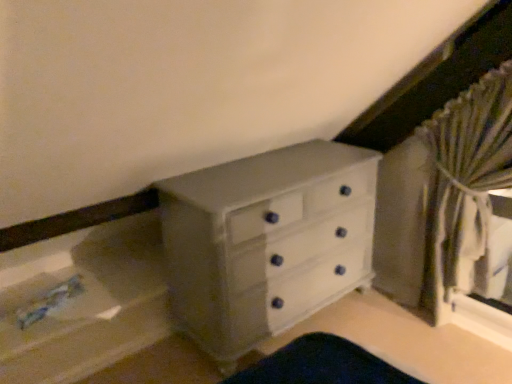
Question: From the image's perspective, is white painted wood chest of drawers at center over striped fabric curtain at right?

Choices:
 (A) no
 (B) yes

Answer: (A)

Question: Is white painted wood chest of drawers at center far from striped fabric curtain at right?

Choices:
 (A) no
 (B) yes

Answer: (A)

Question: From the image's perspective, is white painted wood chest of drawers at center located beneath striped fabric curtain at right?

Choices:
 (A) yes
 (B) no

Answer: (A)

Question: Is white painted wood chest of drawers at center in contact with striped fabric curtain at right?

Choices:
 (A) no
 (B) yes

Answer: (A)

Question: Is white painted wood chest of drawers at center oriented towards striped fabric curtain at right?

Choices:
 (A) no
 (B) yes

Answer: (B)

Question: Considering the relative sizes of white painted wood chest of drawers at center and striped fabric curtain at right in the image provided, is white painted wood chest of drawers at center bigger than striped fabric curtain at right?

Choices:
 (A) yes
 (B) no

Answer: (A)

Question: Can you confirm if striped fabric curtain at right is bigger than white painted wood chest of drawers at center?

Choices:
 (A) no
 (B) yes

Answer: (A)

Question: Are striped fabric curtain at right and white painted wood chest of drawers at center beside each other?

Choices:
 (A) yes
 (B) no

Answer: (B)

Question: From a real-world perspective, is striped fabric curtain at right positioned over white painted wood chest of drawers at center based on gravity?

Choices:
 (A) yes
 (B) no

Answer: (A)

Question: From a real-world perspective, is striped fabric curtain at right under white painted wood chest of drawers at center?

Choices:
 (A) yes
 (B) no

Answer: (B)

Question: Considering the relative positions of striped fabric curtain at right and white painted wood chest of drawers at center in the image provided, is striped fabric curtain at right to the left of white painted wood chest of drawers at center from the viewer's perspective?

Choices:
 (A) no
 (B) yes

Answer: (A)

Question: Is the depth of striped fabric curtain at right greater than that of white painted wood chest of drawers at center?

Choices:
 (A) no
 (B) yes

Answer: (A)

Question: Is striped fabric curtain at right in front of or behind white painted wood chest of drawers at center in the image?

Choices:
 (A) front
 (B) behind

Answer: (A)